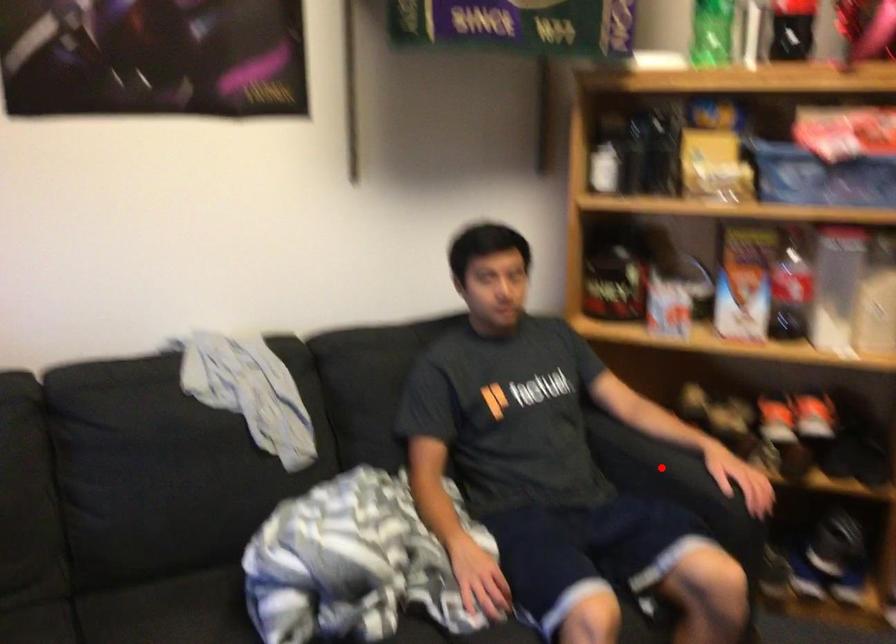
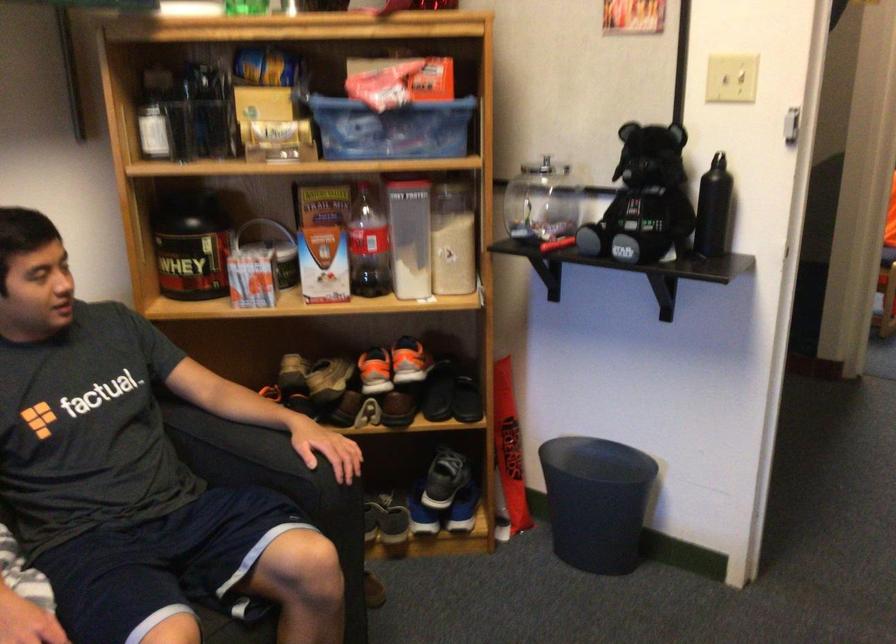
The point at the highlighted location is marked in the first image. Where is the corresponding point in the second image?

(250, 455)